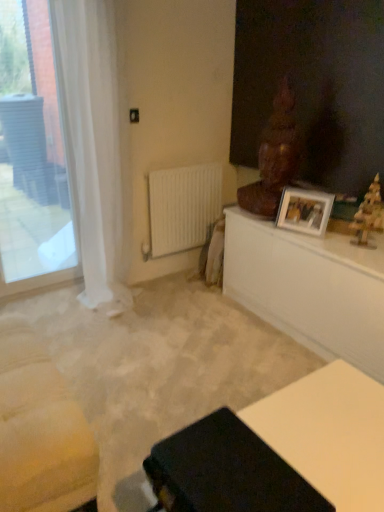
The image size is (384, 512). I want to click on vacant area in front of white sheer curtain at left, so click(107, 330).